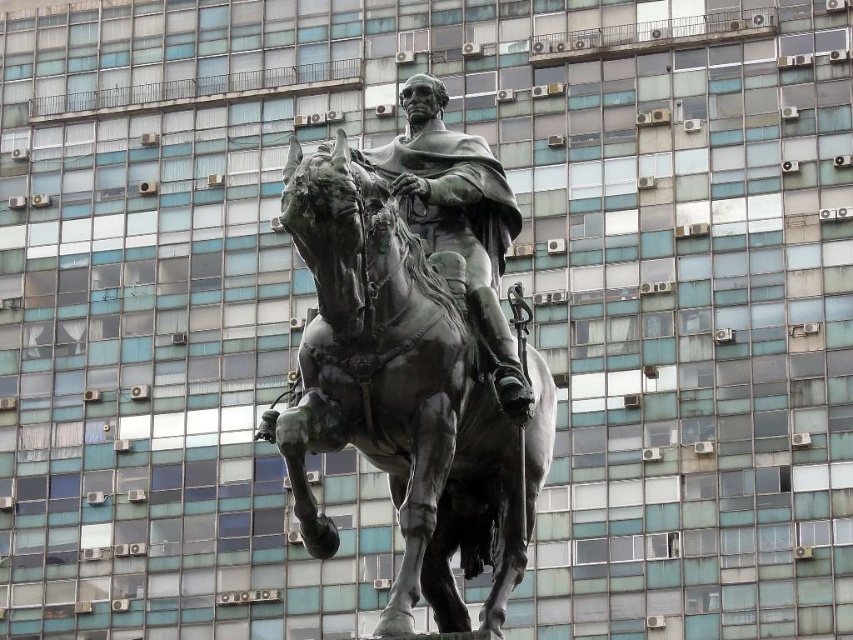
Question: Which of the following is the closest to the observer?

Choices:
 (A) shiny bronze statue at center
 (B) bronze/golden horse at center

Answer: (B)

Question: Among these objects, which one is nearest to the camera?

Choices:
 (A) bronze/golden horse at center
 (B) shiny bronze statue at center

Answer: (A)

Question: Is bronze/golden horse at center positioned behind shiny bronze statue at center?

Choices:
 (A) yes
 (B) no

Answer: (B)

Question: Is bronze/golden horse at center below shiny bronze statue at center?

Choices:
 (A) no
 (B) yes

Answer: (B)

Question: Does bronze/golden horse at center come behind shiny bronze statue at center?

Choices:
 (A) yes
 (B) no

Answer: (B)